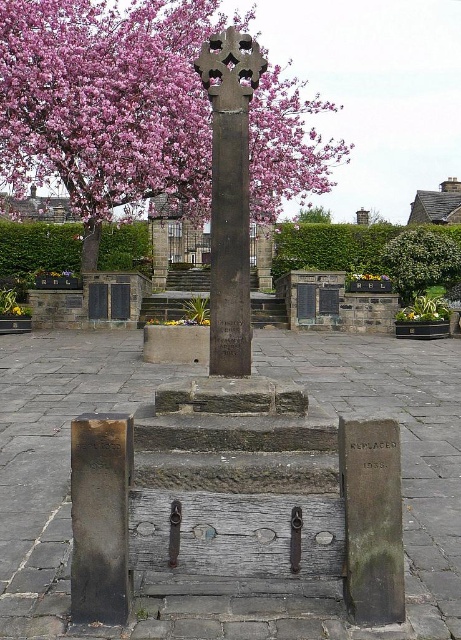
You are standing at the entrance of the memorial site and want to locate the dark gray stone cross at center. Based on your current position, which direction should you face to see it directly?

The dark gray stone cross at center is located at point 0.689 on the x axis and 0.508 on the y axis. Since you are at the entrance, facing towards the center of the memorial site would align you with the dark gray stone cross at center.

You are an archaeologist examining the memorial site. You notice the pink blossoms at upper left and the green leafy plant at center. Which plant has a larger width?

The pink blossoms at upper left might be wider than green leafy plant at center according to the description.

You are a visitor at the memorial site and want to take a photo of both the pink blossoms at upper left and the green leafy plant at center. Which object should you position to the left side of your camera frame?

You should position the pink blossoms at upper left to the left side of your camera frame since it is already to the left of the green leafy plant at center.